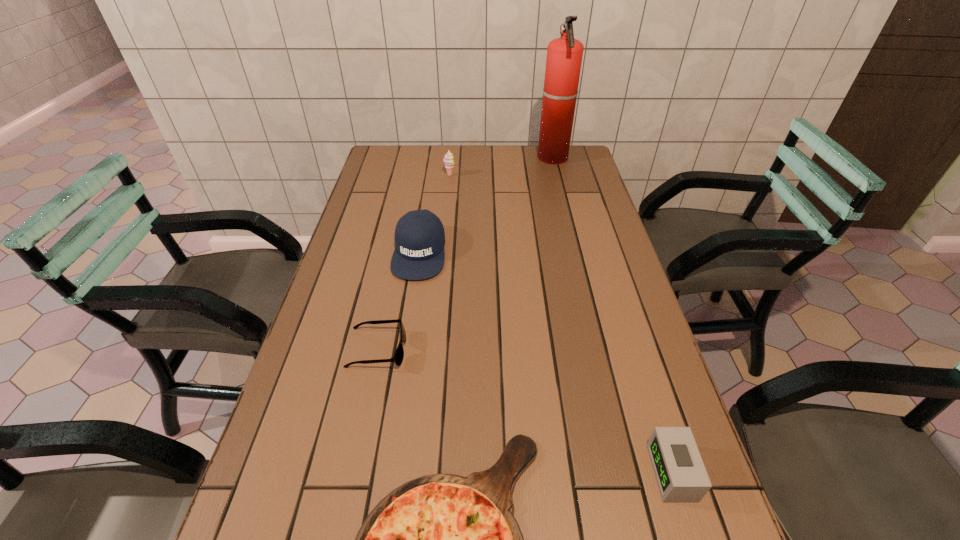
Find the location of a particular element. This screenshot has width=960, height=540. free space between the fire extinguisher and the sherbert is located at coordinates (501, 166).

What are the coordinates of `vacant space that is in between the fire extinguisher and the sherbert` in the screenshot? It's located at (501, 166).

Locate an element on the screen. vacant region between the baseball cap and the alarm clock is located at coordinates (545, 362).

The image size is (960, 540). Identify the location of free space between the alarm clock and the third farthest object. (545, 362).

Find the location of a particular element. Image resolution: width=960 pixels, height=540 pixels. object that is the closest to the pizza is located at coordinates (399, 354).

Where is `the fifth closest object to the baseball cap`? the fifth closest object to the baseball cap is located at coordinates (680, 473).